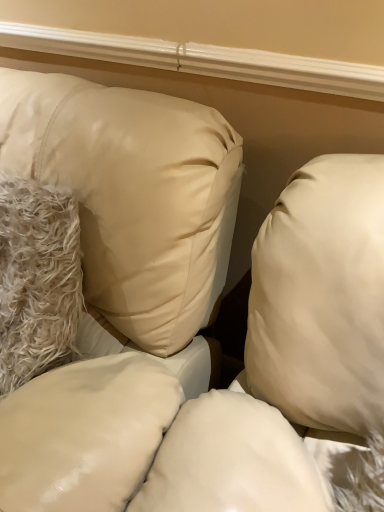
Question: Looking at the image, does white fluffy pillow at left, which ranks as the first pillow in right-to-left order, seem bigger or smaller compared to beige satin pillow at upper left, the first pillow from the left?

Choices:
 (A) big
 (B) small

Answer: (B)

Question: Based on their positions, is white fluffy pillow at left, which ranks as the first pillow in right-to-left order, located to the left or right of beige satin pillow at upper left, acting as the second pillow starting from the right?

Choices:
 (A) right
 (B) left

Answer: (A)

Question: Does point (51, 266) appear closer or farther from the camera than point (172, 157)?

Choices:
 (A) closer
 (B) farther

Answer: (B)

Question: Considering the positions of beige satin pillow at upper left, acting as the second pillow starting from the right, and white fluffy pillow at left, which ranks as the first pillow in right-to-left order, in the image, is beige satin pillow at upper left, acting as the second pillow starting from the right, bigger or smaller than white fluffy pillow at left, which ranks as the first pillow in right-to-left order,?

Choices:
 (A) big
 (B) small

Answer: (A)

Question: From the image's perspective, is beige satin pillow at upper left, acting as the second pillow starting from the right, located above or below white fluffy pillow at left, which appears as the 2th pillow when viewed from the left?

Choices:
 (A) above
 (B) below

Answer: (B)

Question: From a real-world perspective, relative to white fluffy pillow at left, which ranks as the first pillow in right-to-left order, is beige satin pillow at upper left, acting as the second pillow starting from the right, vertically above or below?

Choices:
 (A) above
 (B) below

Answer: (B)

Question: Would you say beige satin pillow at upper left, acting as the second pillow starting from the right, is to the left or to the right of white fluffy pillow at left, which appears as the 2th pillow when viewed from the left, in the picture?

Choices:
 (A) left
 (B) right

Answer: (A)